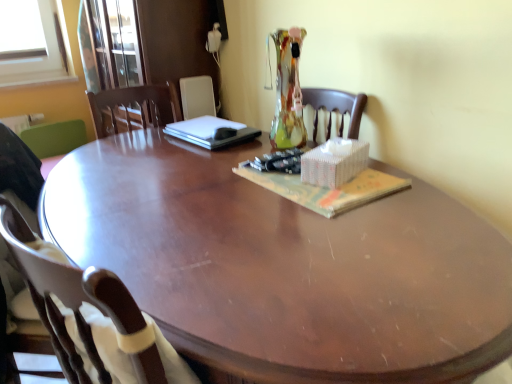
Locate an element on the screen. vacant area that lies in front of matte paper magazine at center is located at coordinates (335, 234).